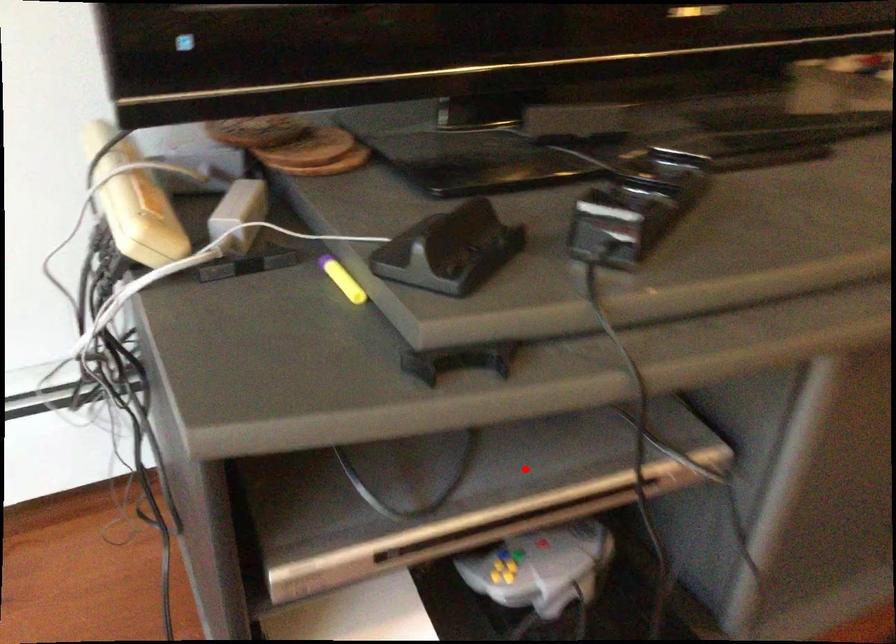
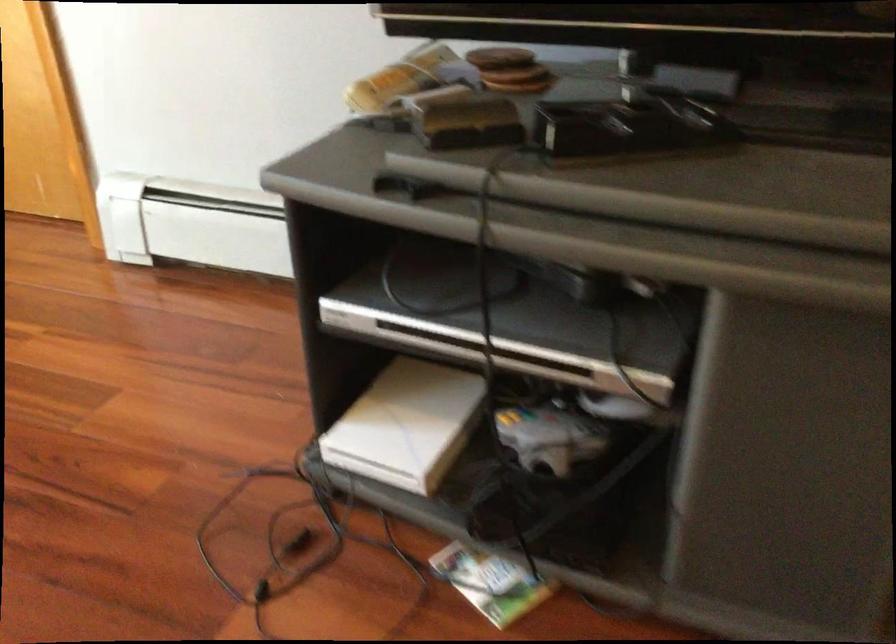
Question: A red point is marked in image1. In image2, is the corresponding 3D point closer to the camera or farther? Reply with the corresponding letter.

Choices:
 (A) The corresponding 3D point is closer.
 (B) The corresponding 3D point is farther.

Answer: (B)